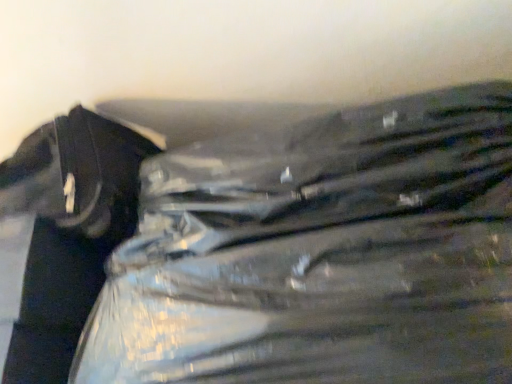
This screenshot has height=384, width=512. What do you see at coordinates (61, 236) in the screenshot?
I see `metallic silver zipper at left` at bounding box center [61, 236].

At what (x,y) coordinates should I click in order to perform the action: click on metallic silver zipper at left. Please return your answer as a coordinate pair (x, y). The height and width of the screenshot is (384, 512). Looking at the image, I should click on (61, 236).

This screenshot has height=384, width=512. What are the coordinates of `transparent plastic bag at center` in the screenshot? It's located at (x=321, y=253).

What do you see at coordinates (321, 253) in the screenshot? Image resolution: width=512 pixels, height=384 pixels. I see `transparent plastic bag at center` at bounding box center [321, 253].

The width and height of the screenshot is (512, 384). Identify the location of metallic silver zipper at left. (61, 236).

Which object is positioned more to the left, transparent plastic bag at center or metallic silver zipper at left?

metallic silver zipper at left.

Considering the relative positions of transparent plastic bag at center and metallic silver zipper at left in the image provided, is transparent plastic bag at center in front of metallic silver zipper at left?

Yes, it is in front of metallic silver zipper at left.

Which point is more forward, [489,130] or [70,188]?

The point [489,130] is more forward.

From the image's perspective, does transparent plastic bag at center appear lower than metallic silver zipper at left?

No, from the image's perspective, transparent plastic bag at center is not below metallic silver zipper at left.

From a real-world perspective, which is physically below, transparent plastic bag at center or metallic silver zipper at left?

transparent plastic bag at center, from a real-world perspective.

Which of these two, transparent plastic bag at center or metallic silver zipper at left, is thinner?

With smaller width is metallic silver zipper at left.

Can you confirm if transparent plastic bag at center is taller than metallic silver zipper at left?

No.

Is transparent plastic bag at center bigger or smaller than metallic silver zipper at left?

In the image, transparent plastic bag at center appears to be larger than metallic silver zipper at left.

Is transparent plastic bag at center positioned beyond the bounds of metallic silver zipper at left?

That's correct, transparent plastic bag at center is outside of metallic silver zipper at left.

In the scene shown: Is transparent plastic bag at center with metallic silver zipper at left?

There is a gap between transparent plastic bag at center and metallic silver zipper at left.

Looking at this image, is transparent plastic bag at center facing towards metallic silver zipper at left?

No, transparent plastic bag at center is not aimed at metallic silver zipper at left.

How different are the orientations of transparent plastic bag at center and metallic silver zipper at left in degrees?

transparent plastic bag at center and metallic silver zipper at left are facing 0.000267 degrees away from each other.

The width and height of the screenshot is (512, 384). Identify the location of plastic bag that appears in front of the metallic silver zipper at left. (321, 253).

Which object is positioned more to the right, metallic silver zipper at left or transparent plastic bag at center?

transparent plastic bag at center.

Does metallic silver zipper at left come behind transparent plastic bag at center?

Yes.

Does point (135, 182) come closer to viewer compared to point (372, 291)?

No, (135, 182) is behind (372, 291).

From the image's perspective, which object appears higher, metallic silver zipper at left or transparent plastic bag at center?

transparent plastic bag at center, from the image's perspective.

From a real-world perspective, is metallic silver zipper at left located beneath transparent plastic bag at center?

No, from a real-world perspective, metallic silver zipper at left is not beneath transparent plastic bag at center.

Considering the relative sizes of metallic silver zipper at left and transparent plastic bag at center in the image provided, is metallic silver zipper at left wider than transparent plastic bag at center?

No.

Is metallic silver zipper at left shorter than transparent plastic bag at center?

No, metallic silver zipper at left is not shorter than transparent plastic bag at center.

Based on the photo, can you confirm if metallic silver zipper at left is bigger than transparent plastic bag at center?

No.

Is metallic silver zipper at left not inside transparent plastic bag at center?

metallic silver zipper at left lies outside transparent plastic bag at center's area.

Are metallic silver zipper at left and transparent plastic bag at center located far from each other?

No, metallic silver zipper at left is not far from transparent plastic bag at center.

Is transparent plastic bag at center at the back of metallic silver zipper at left?

No.

How different are the orientations of metallic silver zipper at left and transparent plastic bag at center in degrees?

0.000267 degrees.

This screenshot has width=512, height=384. In order to click on waste below the transparent plastic bag at center (from the image's perspective) in this screenshot , I will do `click(61, 236)`.

This screenshot has height=384, width=512. I want to click on plastic bag beneath the metallic silver zipper at left (from a real-world perspective), so click(321, 253).

This screenshot has height=384, width=512. What are the coordinates of `plastic bag in front of the metallic silver zipper at left` in the screenshot? It's located at (321, 253).